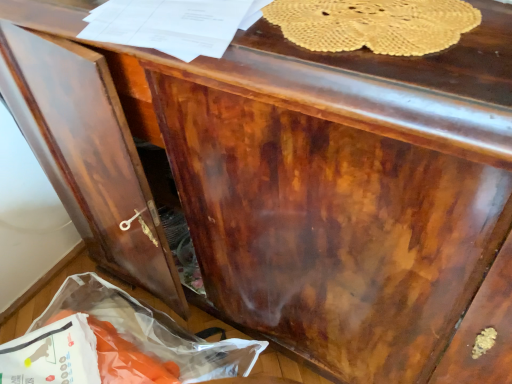
Image resolution: width=512 pixels, height=384 pixels. I want to click on vacant location below yellow crocheted doily at upper center (from a real-world perspective), so click(x=369, y=21).